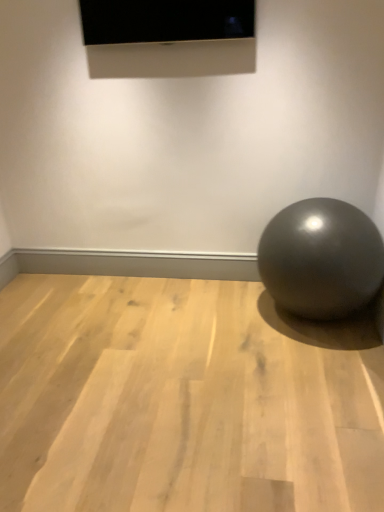
You are a GUI agent. You are given a task and a screenshot of the screen. Output one action in this format:
    pyautogui.click(x=<x>, y=<y>)
    Task: Click on the light wood floor at center
    
    Given the screenshot: What is the action you would take?
    pyautogui.click(x=183, y=400)

I want to click on projection screen on the left of glossy metallic ball at lower right, so click(165, 20).

Between matte black screen at upper center and glossy metallic ball at lower right, which one has larger size?

Bigger between the two is glossy metallic ball at lower right.

Is matte black screen at upper center looking in the opposite direction of glossy metallic ball at lower right?

matte black screen at upper center does not have its back to glossy metallic ball at lower right.

Is glossy metallic ball at lower right in front of or behind light wood floor at center in the image?

In the image, glossy metallic ball at lower right appears behind light wood floor at center.

How different are the orientations of glossy metallic ball at lower right and light wood floor at center in degrees?

The angular difference between glossy metallic ball at lower right and light wood floor at center is 1.3 degrees.

Is glossy metallic ball at lower right taller or shorter than light wood floor at center?

Clearly, glossy metallic ball at lower right is taller compared to light wood floor at center.

Is glossy metallic ball at lower right completely or partially outside of light wood floor at center?

Yes, glossy metallic ball at lower right is not within light wood floor at center.

Is light wood floor at center far away from glossy metallic ball at lower right?

light wood floor at center is near glossy metallic ball at lower right, not far away.

Which object is positioned more to the left, light wood floor at center or glossy metallic ball at lower right?

light wood floor at center is more to the left.

Consider the image. Would you say light wood floor at center is outside glossy metallic ball at lower right?

That's correct, light wood floor at center is outside of glossy metallic ball at lower right.

Is light wood floor at center wider than glossy metallic ball at lower right?

Yes.

Can you confirm if matte black screen at upper center is shorter than light wood floor at center?

No.

Is matte black screen at upper center located outside light wood floor at center?

Yes, matte black screen at upper center is not within light wood floor at center.

From the image's perspective, is matte black screen at upper center located above light wood floor at center?

Correct, matte black screen at upper center appears higher than light wood floor at center in the image.

Would you say glossy metallic ball at lower right contains matte black screen at upper center?

Definitely not — matte black screen at upper center is not inside glossy metallic ball at lower right.

Is glossy metallic ball at lower right positioned with its back to matte black screen at upper center?

No, matte black screen at upper center is not at the back of glossy metallic ball at lower right.

Which is more to the right, glossy metallic ball at lower right or matte black screen at upper center?

glossy metallic ball at lower right.

Considering the sizes of objects glossy metallic ball at lower right and matte black screen at upper center in the image provided, who is shorter, glossy metallic ball at lower right or matte black screen at upper center?

matte black screen at upper center.

Is light wood floor at center looking in the opposite direction of matte black screen at upper center?

No, light wood floor at center's orientation is not away from matte black screen at upper center.

In the scene shown: Is the surface of light wood floor at center in direct contact with matte black screen at upper center?

No, light wood floor at center is not touching matte black screen at upper center.

Which is closer, (366, 383) or (100, 35)?

Point (366, 383) is closer to the camera than point (100, 35).

The width and height of the screenshot is (384, 512). I want to click on projection screen on the right of light wood floor at center, so click(165, 20).

Identify the location of projection screen that is above the glossy metallic ball at lower right (from the image's perspective). (165, 20).

Find the location of a particular element. The height and width of the screenshot is (512, 384). surface below the glossy metallic ball at lower right (from a real-world perspective) is located at coordinates (183, 400).

Looking at the image, which one is located further to glossy metallic ball at lower right, light wood floor at center or matte black screen at upper center?

Based on the image, matte black screen at upper center appears to be further to glossy metallic ball at lower right.

Considering their positions, is matte black screen at upper center positioned closer to light wood floor at center than glossy metallic ball at lower right?

Based on the image, glossy metallic ball at lower right appears to be nearer to light wood floor at center.

Which object lies further to the anchor point light wood floor at center, glossy metallic ball at lower right or matte black screen at upper center?

Based on the image, matte black screen at upper center appears to be further to light wood floor at center.

When comparing their distances from glossy metallic ball at lower right, does matte black screen at upper center or light wood floor at center seem closer?

light wood floor at center.

When comparing their distances from matte black screen at upper center, does light wood floor at center or glossy metallic ball at lower right seem closer?

glossy metallic ball at lower right is closer to matte black screen at upper center.

Looking at the image, which one is located further to matte black screen at upper center, glossy metallic ball at lower right or light wood floor at center?

Among the two, light wood floor at center is located further to matte black screen at upper center.

Locate an element on the screen. The width and height of the screenshot is (384, 512). ball between matte black screen at upper center and light wood floor at center from top to bottom is located at coordinates (321, 259).